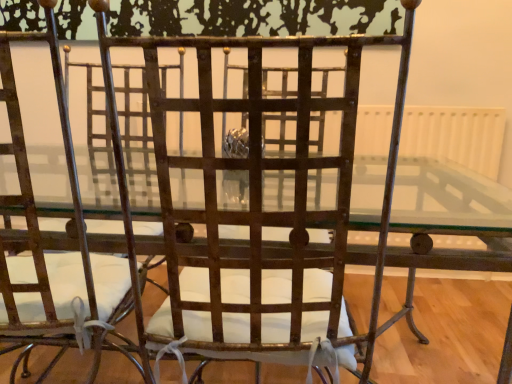
Where is `rustic metal chair at left`? rustic metal chair at left is located at coordinates (59, 253).

What do you see at coordinates (59, 253) in the screenshot? The height and width of the screenshot is (384, 512). I see `rustic metal chair at left` at bounding box center [59, 253].

Based on the photo, what is the approximate height of rustic metal chair at left?

rustic metal chair at left is 1.10 meters tall.

Identify the location of rustic metal chair at left. Image resolution: width=512 pixels, height=384 pixels. (59, 253).